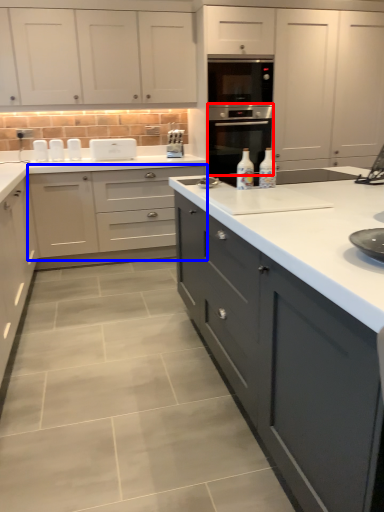
Question: Among these objects, which one is nearest to the camera, home appliance (highlighted by a red box) or cabinetry (highlighted by a blue box)?

Choices:
 (A) home appliance
 (B) cabinetry

Answer: (B)